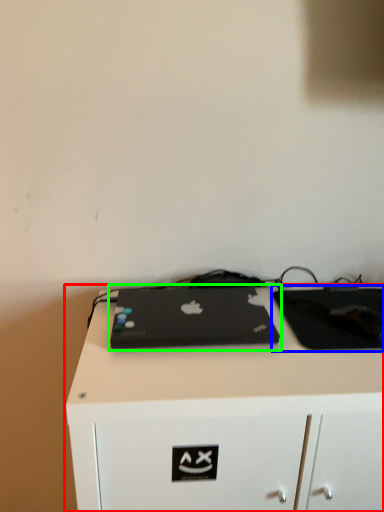
Question: Estimate the real-world distances between objects in this image. Which object is closer to desk (highlighted by a red box), tablet computer (highlighted by a blue box) or laptop (highlighted by a green box)?

Choices:
 (A) tablet computer
 (B) laptop

Answer: (B)